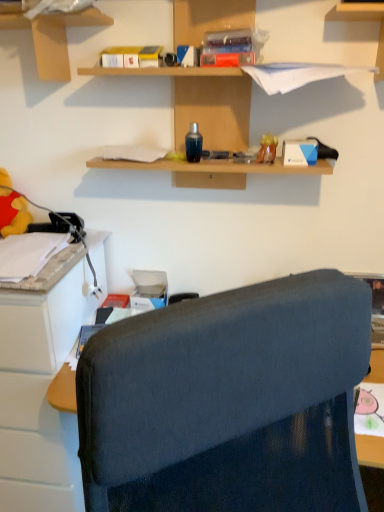
Question: Considering the positions of matte cardboard box at upper left, placed as the second shelf when sorted from right to left, and wooden shelves at upper center, acting as the first shelf starting from the right, in the image, is matte cardboard box at upper left, placed as the second shelf when sorted from right to left, wider or thinner than wooden shelves at upper center, acting as the first shelf starting from the right,?

Choices:
 (A) wide
 (B) thin

Answer: (B)

Question: From a real-world perspective, relative to wooden shelves at upper center, acting as the first shelf starting from the right, is matte cardboard box at upper left, arranged as the 1th shelf when viewed from the left, vertically above or below?

Choices:
 (A) below
 (B) above

Answer: (B)

Question: Considering the real-world distances, which object is closest to the wooden shelves at upper center, acting as the first shelf starting from the right?

Choices:
 (A) white plastic cabinet at left
 (B) matte cardboard box at upper left, arranged as the 1th shelf when viewed from the left
 (C) yellow plush toy at left, the second toy when ordered from right to left
 (D) matte plastic toy at upper right, which is counted as the first toy, starting from the front

Answer: (B)

Question: Estimate the real-world distances between objects in this image. Which object is farther from the yellow plush toy at left, the second toy when ordered from right to left?

Choices:
 (A) wooden shelves at upper center, acting as the first shelf starting from the right
 (B) matte plastic toy at upper right, which is the second toy in back-to-front order
 (C) white plastic cabinet at left
 (D) matte cardboard box at upper left, placed as the second shelf when sorted from right to left

Answer: (B)